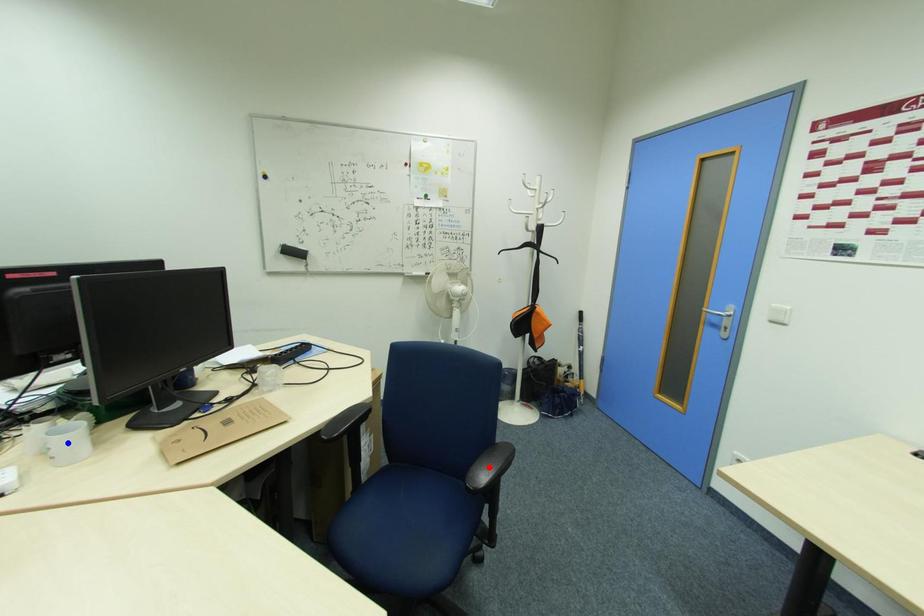
Question: In the image, two points are highlighted. Which point is nearer to the camera? Reply with the corresponding letter.

Choices:
 (A) blue point
 (B) red point

Answer: (A)